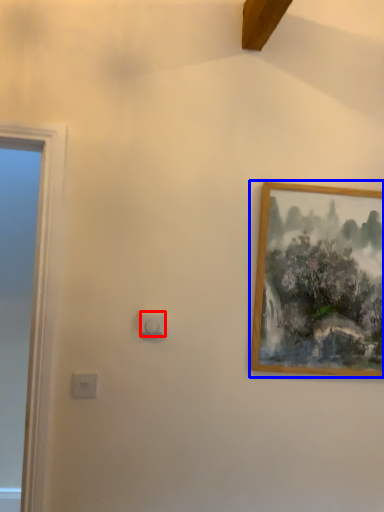
Question: Which object is further to the camera taking this photo, light switch (highlighted by a red box) or picture frame (highlighted by a blue box)?

Choices:
 (A) light switch
 (B) picture frame

Answer: (B)